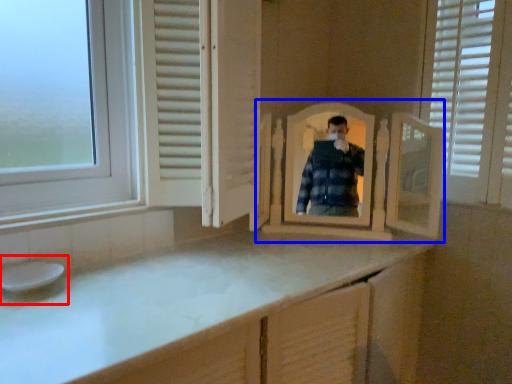
Question: Which of the following is the closest to the observer, sink (highlighted by a red box) or mirror (highlighted by a blue box)?

Choices:
 (A) sink
 (B) mirror

Answer: (A)